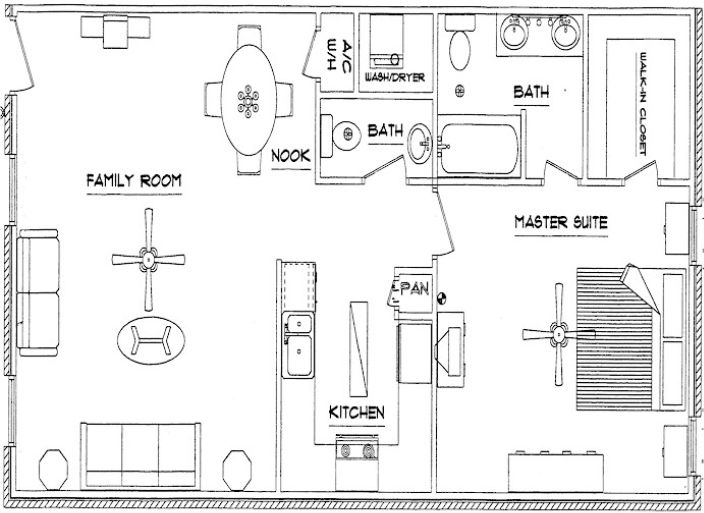
Find the location of a particular element. The height and width of the screenshot is (513, 704). kitchen table is located at coordinates [x=249, y=89].